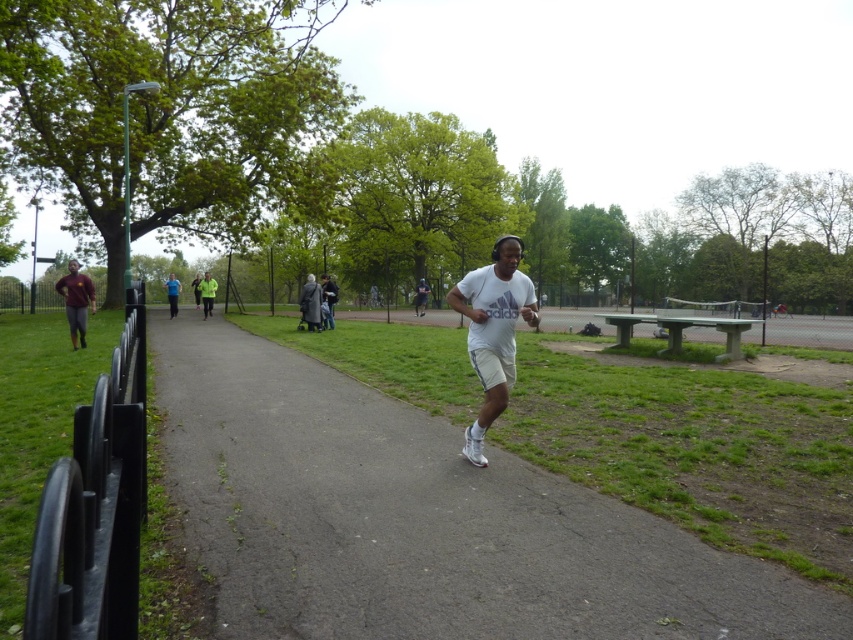
You are standing at the grassy area near the black metal fence and want to reach the jogging man on the path. Which point, point (624, 618) or point (466, 289), is closer to you?

Point (624, 618) is closer to you because it is in front of point (466, 289).